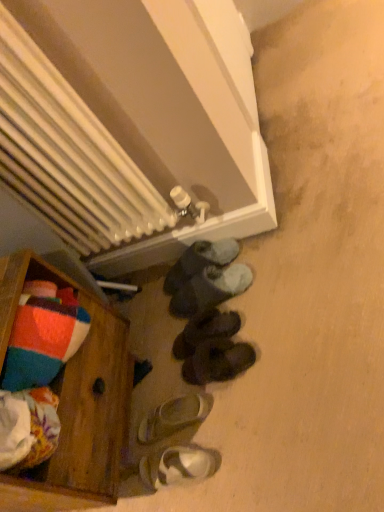
This screenshot has height=512, width=384. In order to click on vacant space in front of dark gray suede slippers at lower center, the second footwear positioned from the top in this screenshot , I will do `click(249, 323)`.